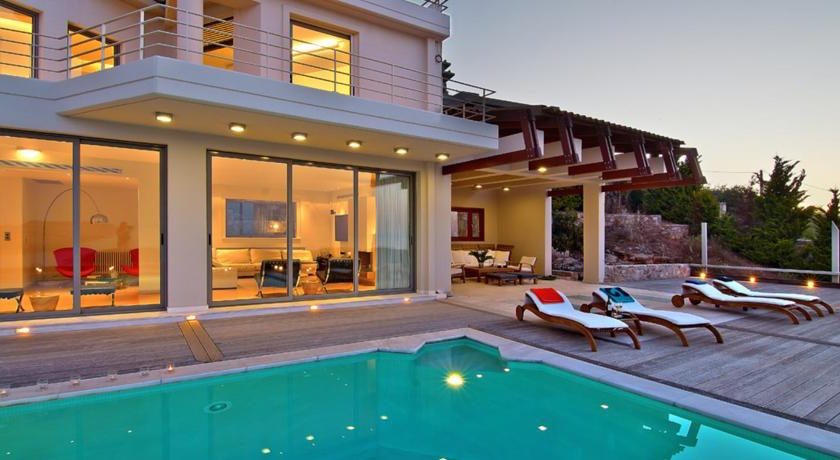
Locate an element on the screen. red towel is located at coordinates (547, 298).